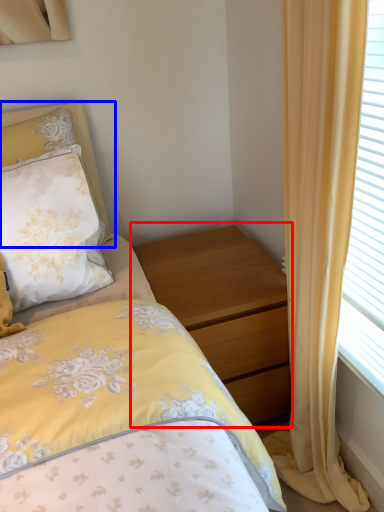
Question: Which object appears closest to the camera in this image, nightstand (highlighted by a red box) or pillow (highlighted by a blue box)?

Choices:
 (A) nightstand
 (B) pillow

Answer: (B)